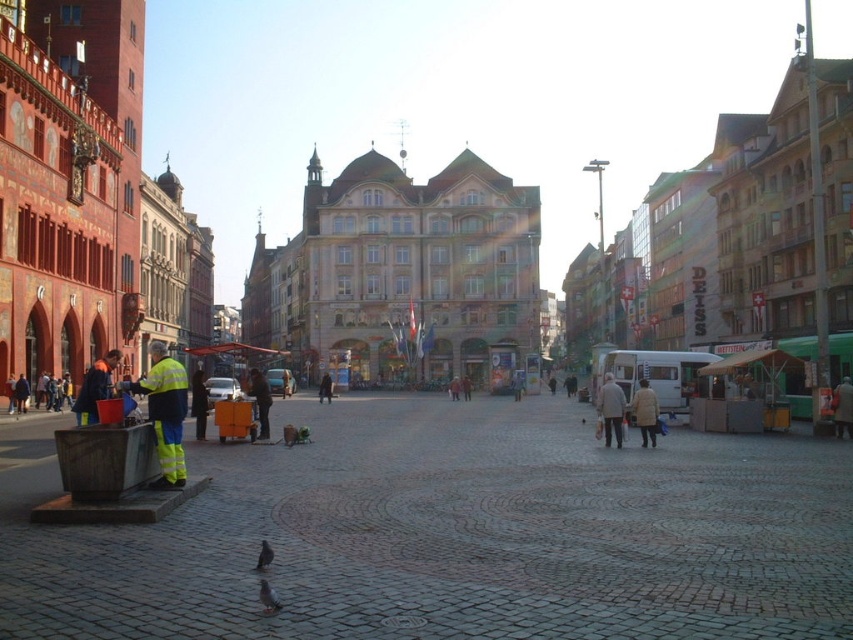
Question: Is yellow reflective jacket at lower left positioned in front of gray feathered pigeon at lower center?

Choices:
 (A) no
 (B) yes

Answer: (A)

Question: Estimate the real-world distances between objects in this image. Which object is farther from the gray feathered pigeon at lower center?

Choices:
 (A) gray feathered bird at center
 (B) light brown coat at center
 (C) reflective silver jacket at center

Answer: (B)

Question: Which point is closer to the camera taking this photo?

Choices:
 (A) (260, 548)
 (B) (654, 397)

Answer: (A)

Question: Estimate the real-world distances between objects in this image. Which object is closer to the light brown coat at center?

Choices:
 (A) light beige coat at center
 (B) gray feathered pigeon at lower center
 (C) gray feathered bird at center
 (D) yellow reflective jacket at lower left

Answer: (A)

Question: Is yellow reflective jacket at lower left smaller than light beige coat at center?

Choices:
 (A) yes
 (B) no

Answer: (B)

Question: Can you confirm if light brown coat at center is positioned to the left of reflective silver jacket at center?

Choices:
 (A) no
 (B) yes

Answer: (A)